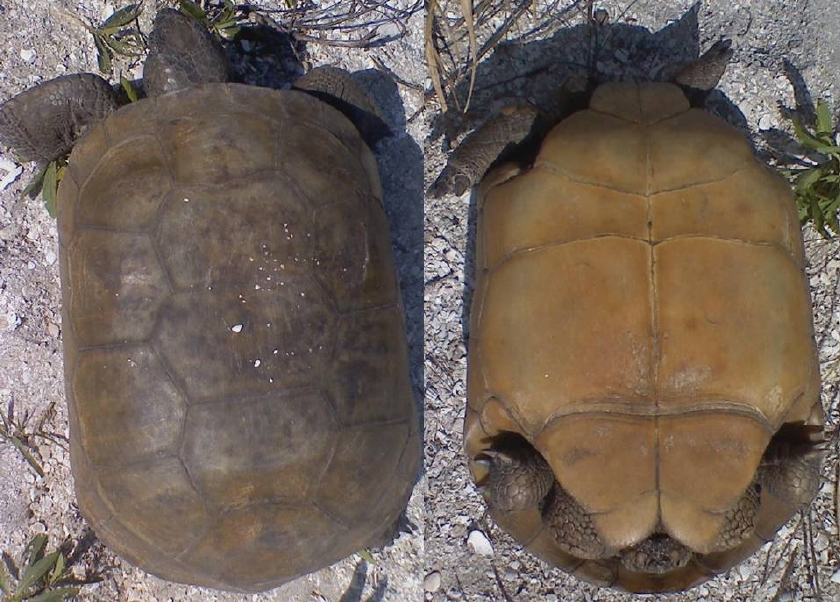
Where is `plant`? The image size is (840, 602). plant is located at coordinates (820, 166).